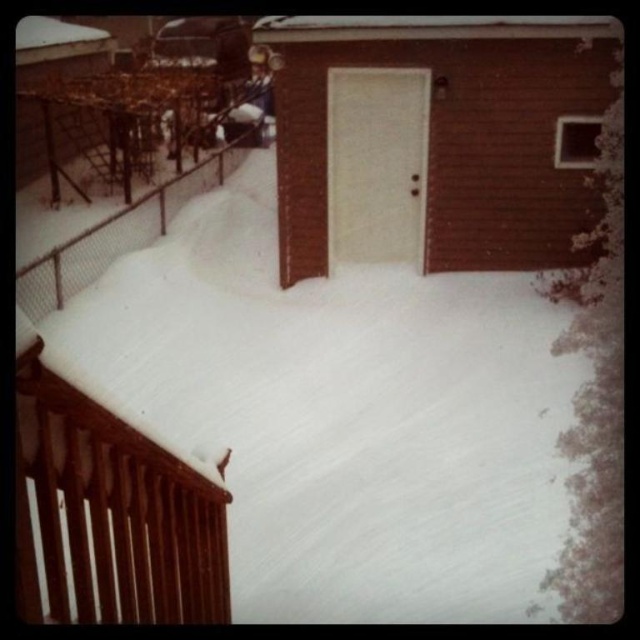
Question: Is brown wooden balustrade at lower left closer to the viewer compared to wire mesh fence at left?

Choices:
 (A) no
 (B) yes

Answer: (B)

Question: Which object is the farthest from the brown wooden balustrade at lower left?

Choices:
 (A) white fluffy snow at lower center
 (B) wire mesh fence at left

Answer: (B)

Question: Does brown wooden balustrade at lower left appear over wire mesh fence at left?

Choices:
 (A) no
 (B) yes

Answer: (A)

Question: Which point is closer to the camera?

Choices:
 (A) brown wooden balustrade at lower left
 (B) white fluffy snow at lower center
 (C) wire mesh fence at left

Answer: (A)

Question: Which object appears farthest from the camera in this image?

Choices:
 (A) white fluffy snow at lower center
 (B) brown wooden balustrade at lower left
 (C) wire mesh fence at left

Answer: (C)

Question: Does white fluffy snow at lower center appear over wire mesh fence at left?

Choices:
 (A) yes
 (B) no

Answer: (B)